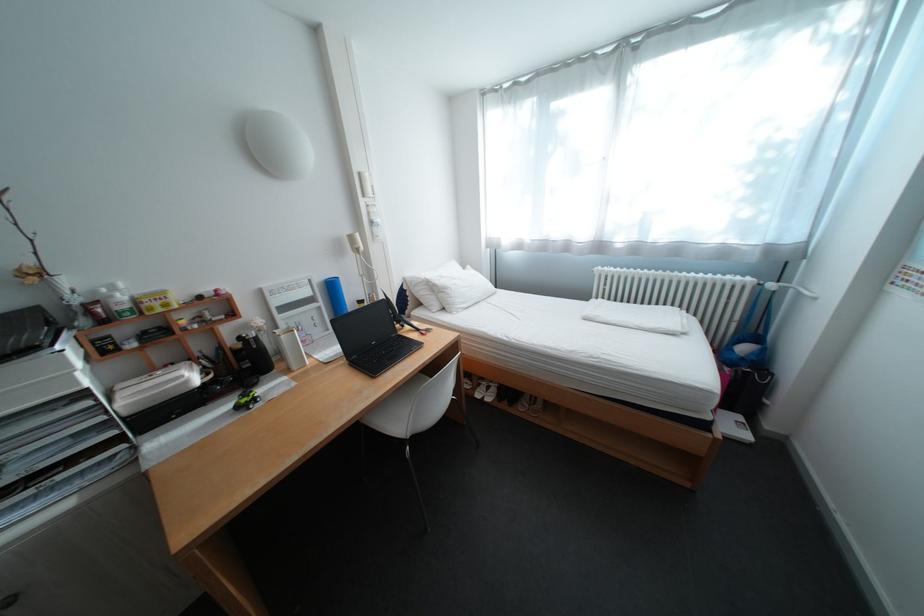
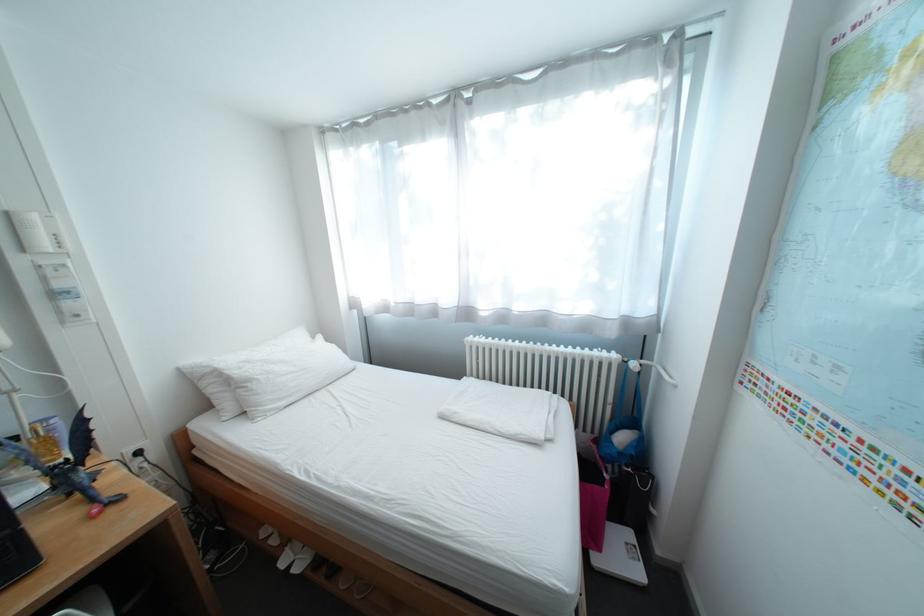
Question: I am providing you with two images of the same scene from different viewpoints. Please identify which objects are invisible in image2.

Choices:
 (A) gold perfume bottle
 (B) folded white cloth
 (C) power socket
 (D) none of these

Answer: (D)